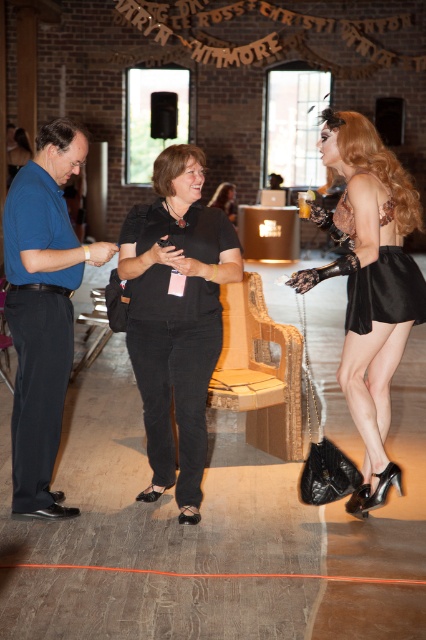
Question: Which of these objects is positioned closest to the black matte/black pants at center?

Choices:
 (A) velvet black dress at right
 (B) black matte dress at center
 (C) black satin dress at right

Answer: (A)

Question: Can you confirm if velvet black dress at right is thinner than black matte dress at center?

Choices:
 (A) no
 (B) yes

Answer: (A)

Question: Does black matte/black pants at center have a greater width compared to velvet black dress at right?

Choices:
 (A) yes
 (B) no

Answer: (B)

Question: Which object appears farthest from the camera in this image?

Choices:
 (A) black satin dress at right
 (B) black matte dress at center
 (C) velvet black dress at right
 (D) black matte/black pants at center

Answer: (B)

Question: Is black matte/black pants at center positioned behind velvet black dress at right?

Choices:
 (A) yes
 (B) no

Answer: (A)

Question: Considering the real-world distances, which object is closest to the black satin dress at right?

Choices:
 (A) blue smooth shirt at center
 (B) black matte/black pants at center
 (C) black matte dress at center
 (D) velvet black dress at right

Answer: (D)